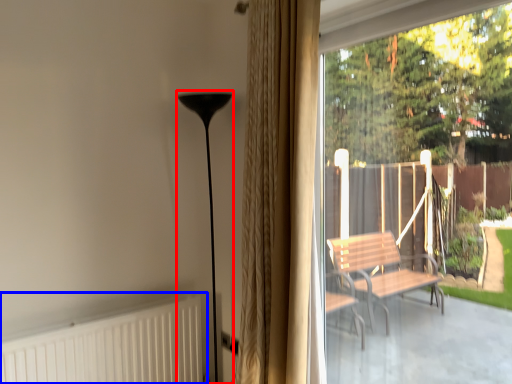
Question: Which of the following is the closest to the observer, lamp (highlighted by a red box) or radiator (highlighted by a blue box)?

Choices:
 (A) lamp
 (B) radiator

Answer: (B)